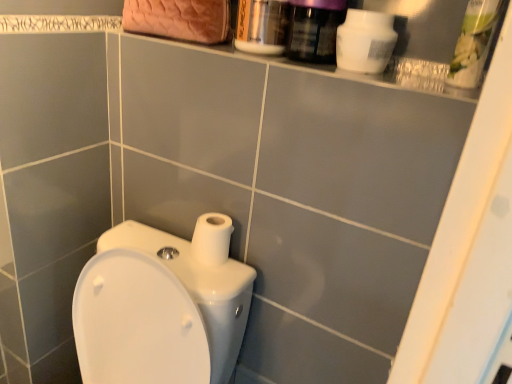
Question: Based on their positions, is white matte toilet paper at center located to the left or right of white matte bottle at upper right, marked as the 1th cleaning product in a left-to-right arrangement?

Choices:
 (A) right
 (B) left

Answer: (B)

Question: From a real-world perspective, is white matte toilet paper at center above or below white matte bottle at upper right, marked as the 1th cleaning product in a left-to-right arrangement?

Choices:
 (A) above
 (B) below

Answer: (B)

Question: Which object is positioned farthest from the white glossy toilet at lower left?

Choices:
 (A) white matte toilet paper at center
 (B) metallic silver mouthwash at upper center, positioned as the first mouthwash in left-to-right order
 (C) green plastic container at upper right, arranged as the 2th cleaning product when viewed from the left
 (D) purple glossy mouthwash at upper right, placed as the second mouthwash when sorted from left to right
 (E) white matte bottle at upper right, which is the second cleaning product in right-to-left order

Answer: (C)

Question: Estimate the real-world distances between objects in this image. Which object is farther from the green plastic container at upper right, marked as the first cleaning product in a right-to-left arrangement?

Choices:
 (A) metallic silver mouthwash at upper center, marked as the 2th mouthwash in a right-to-left arrangement
 (B) white glossy toilet at lower left
 (C) purple glossy mouthwash at upper right, placed as the second mouthwash when sorted from left to right
 (D) white matte toilet paper at center
 (E) white matte bottle at upper right, marked as the 1th cleaning product in a left-to-right arrangement

Answer: (B)